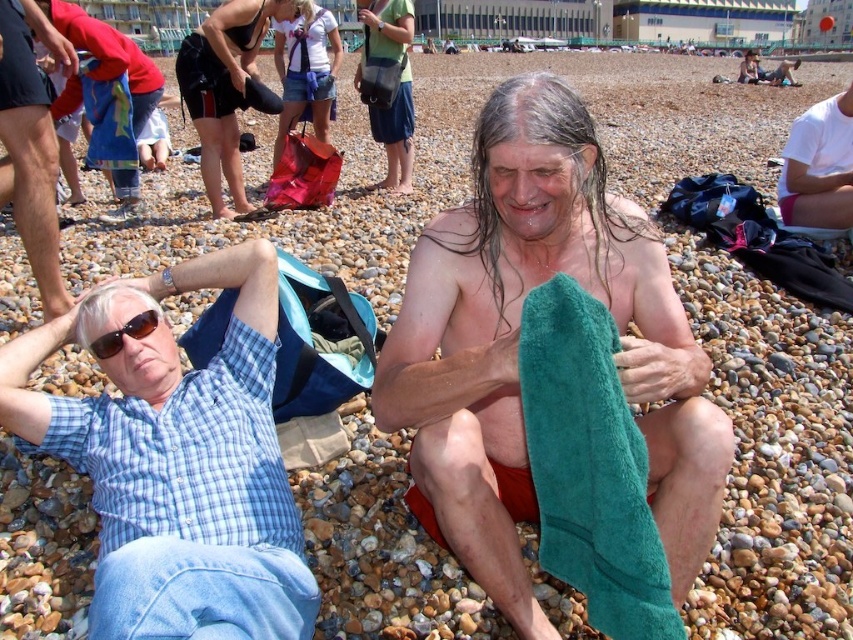
Based on the scene description, where is the black fabric shorts at center located in terms of coordinates?

The black fabric shorts at center are located at coordinates point [227,88].

You are a photographer standing at the edge of the beach, and you want to take a photo of the black fabric shorts at center and the matte black bag at center. Which object should you focus on first to ensure both are in focus?

You should focus on the black fabric shorts at center first because it is closer to the viewer than the matte black bag at center, so focusing on the closer object will help both be in focus.